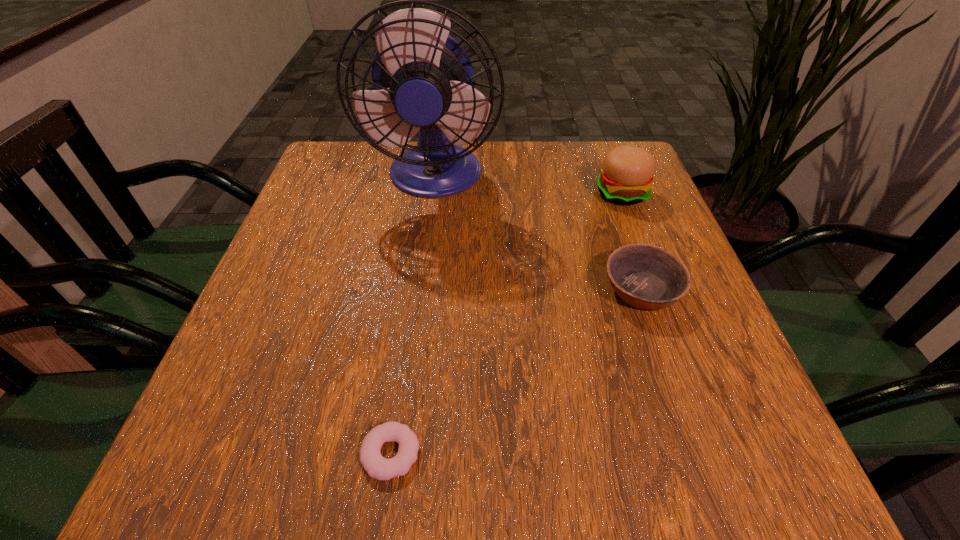
Where is `vacant area that lies between the second shortest object and the shortest object`? vacant area that lies between the second shortest object and the shortest object is located at coordinates (516, 372).

Locate an element on the screen. This screenshot has width=960, height=540. vacant space that is in between the shortest object and the second tallest object is located at coordinates (506, 323).

Where is `vacant area that lies between the second tallest object and the bowl`? This screenshot has width=960, height=540. vacant area that lies between the second tallest object and the bowl is located at coordinates (631, 241).

Find the location of `vacant area that lies between the hamburger and the tallest object`. vacant area that lies between the hamburger and the tallest object is located at coordinates pyautogui.click(x=528, y=185).

Where is `the closest object to the nearest object`? This screenshot has height=540, width=960. the closest object to the nearest object is located at coordinates (647, 277).

Locate an element on the screen. The image size is (960, 540). the second closest object to the fan is located at coordinates (647, 277).

You are a GUI agent. You are given a task and a screenshot of the screen. Output one action in this format:
    pyautogui.click(x=<x>, y=<y>)
    Task: Click on the vacant position in the image that satisfies the following two spatial constraints: 1. in front of the fan where the airflow is directed; 2. on the left side of the bowl
    The width and height of the screenshot is (960, 540).
    Given the screenshot: What is the action you would take?
    pyautogui.click(x=420, y=290)

Where is `vacant region that satisfies the following two spatial constraints: 1. on the back side of the third farthest object; 2. on the right side of the doughnut`? This screenshot has width=960, height=540. vacant region that satisfies the following two spatial constraints: 1. on the back side of the third farthest object; 2. on the right side of the doughnut is located at coordinates pos(414,290).

Locate an element on the screen. Image resolution: width=960 pixels, height=540 pixels. free space that satisfies the following two spatial constraints: 1. in front of the bowl where the airflow is directed; 2. on the left side of the fan is located at coordinates (420, 290).

Where is `vacant region that satisfies the following two spatial constraints: 1. in front of the fan where the airflow is directed; 2. on the left side of the hamburger`? The image size is (960, 540). vacant region that satisfies the following two spatial constraints: 1. in front of the fan where the airflow is directed; 2. on the left side of the hamburger is located at coordinates (433, 193).